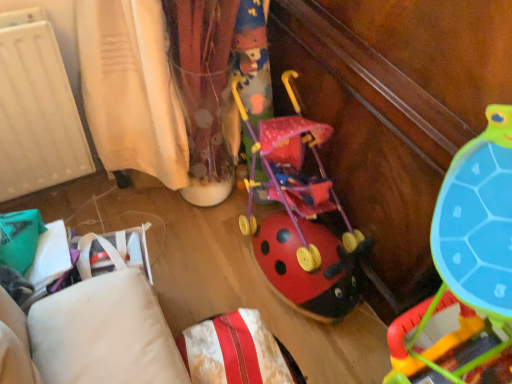
Question: Is rubberized plastic ladybug stroller at center, arranged as the first toy when ordered from the bottom, inside velvety white pillow at lower center?

Choices:
 (A) yes
 (B) no

Answer: (B)

Question: Considering the relative positions of velvety white pillow at lower center and rubberized plastic ladybug stroller at center, arranged as the first toy when ordered from the bottom, in the image provided, is velvety white pillow at lower center to the right of rubberized plastic ladybug stroller at center, arranged as the first toy when ordered from the bottom, from the viewer's perspective?

Choices:
 (A) yes
 (B) no

Answer: (B)

Question: From a real-world perspective, does velvety white pillow at lower center stand above rubberized plastic ladybug stroller at center, arranged as the first toy when ordered from the bottom?

Choices:
 (A) yes
 (B) no

Answer: (B)

Question: From the image's perspective, does velvety white pillow at lower center appear lower than rubberized plastic ladybug stroller at center, arranged as the first toy when ordered from the bottom?

Choices:
 (A) yes
 (B) no

Answer: (A)

Question: Is velvety white pillow at lower center to the left of rubberized plastic ladybug stroller at center, the 2th toy viewed from the top, from the viewer's perspective?

Choices:
 (A) yes
 (B) no

Answer: (A)

Question: Relative to velvety white pillow at lower center, is rubberized plastic ladybug stroller at center, the 2th toy viewed from the top, in front or behind?

Choices:
 (A) behind
 (B) front

Answer: (B)

Question: Is rubberized plastic ladybug stroller at center, arranged as the first toy when ordered from the bottom, inside the boundaries of velvety white pillow at lower center, or outside?

Choices:
 (A) outside
 (B) inside

Answer: (A)

Question: From their relative heights in the image, would you say rubberized plastic ladybug stroller at center, the 2th toy viewed from the top, is taller or shorter than velvety white pillow at lower center?

Choices:
 (A) tall
 (B) short

Answer: (A)

Question: From the image's perspective, relative to velvety white pillow at lower center, is rubberized plastic ladybug stroller at center, the 2th toy viewed from the top, above or below?

Choices:
 (A) below
 (B) above

Answer: (B)

Question: Considering the positions of point (260, 334) and point (459, 311), is point (260, 334) closer or farther from the camera than point (459, 311)?

Choices:
 (A) closer
 (B) farther

Answer: (A)

Question: From the image's perspective, relative to rubberized plastic ladybug stroller at center, arranged as the first toy when ordered from the bottom, is velvety white pillow at lower center above or below?

Choices:
 (A) below
 (B) above

Answer: (A)

Question: Choose the correct answer: Is velvety white pillow at lower center inside rubberized plastic ladybug stroller at center, arranged as the first toy when ordered from the bottom, or outside it?

Choices:
 (A) outside
 (B) inside

Answer: (A)

Question: In the image, is velvety white pillow at lower center positioned in front of or behind rubberized plastic ladybug stroller at center, arranged as the first toy when ordered from the bottom?

Choices:
 (A) behind
 (B) front

Answer: (A)

Question: Is velvety white pillow at lower center wider or thinner than matte plastic stroller at center, the 1th toy in the top-to-bottom sequence?

Choices:
 (A) thin
 (B) wide

Answer: (A)

Question: Does point (247, 339) appear closer or farther from the camera than point (290, 173)?

Choices:
 (A) farther
 (B) closer

Answer: (B)